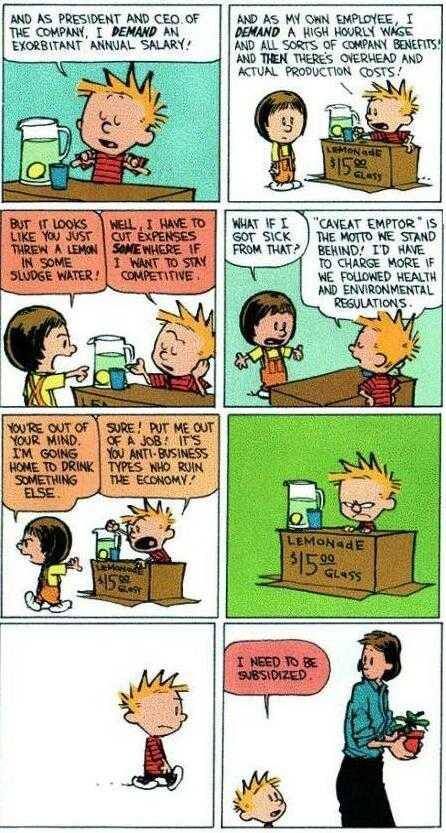
This screenshot has height=833, width=446. In order to click on box flaps in this screenshot , I will do pyautogui.click(x=318, y=172), pyautogui.click(x=343, y=183), pyautogui.click(x=420, y=183), pyautogui.click(x=405, y=591), pyautogui.click(x=337, y=592), pyautogui.click(x=278, y=572), pyautogui.click(x=185, y=597), pyautogui.click(x=121, y=601), pyautogui.click(x=87, y=589).